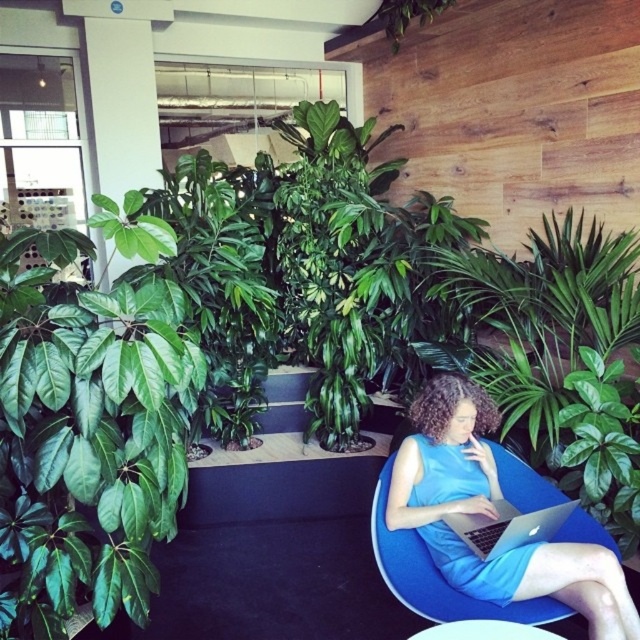
Between green leafy plant at left and silver metallic laptop at center, which one is positioned lower?

Positioned lower is silver metallic laptop at center.

Is point (184, 356) closer to viewer compared to point (500, 552)?

Yes, point (184, 356) is closer to viewer.

The width and height of the screenshot is (640, 640). What are the coordinates of `green leafy plant at left` in the screenshot? It's located at (90, 429).

Which of these two, blue fabric chair at lower right or silver metallic laptop at center, stands taller?

blue fabric chair at lower right

Does blue fabric chair at lower right appear on the right side of silver metallic laptop at center?

Incorrect, blue fabric chair at lower right is not on the right side of silver metallic laptop at center.

You are a GUI agent. You are given a task and a screenshot of the screen. Output one action in this format:
    pyautogui.click(x=<x>, y=<y>)
    Task: Click on the blue fabric chair at lower right
    The height and width of the screenshot is (640, 640).
    Given the screenshot: What is the action you would take?
    pyautogui.click(x=492, y=515)

Between green leafy plant at left and blue fabric chair at lower right, which one has less height?

Standing shorter between the two is blue fabric chair at lower right.

Identify the location of green leafy plant at left. This screenshot has height=640, width=640. (90, 429).

The image size is (640, 640). In order to click on green leafy plant at left in this screenshot , I will do `click(90, 429)`.